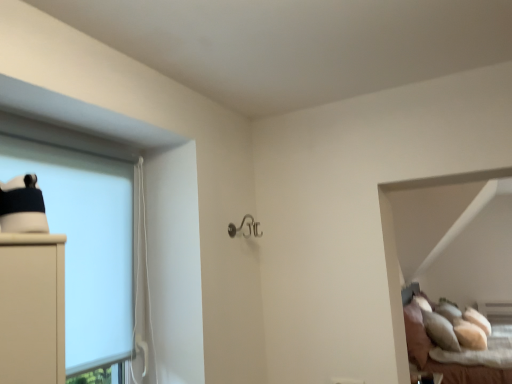
In order to click on free point above white matte cabinet at left (from a real-world perspective) in this screenshot , I will do `click(81, 141)`.